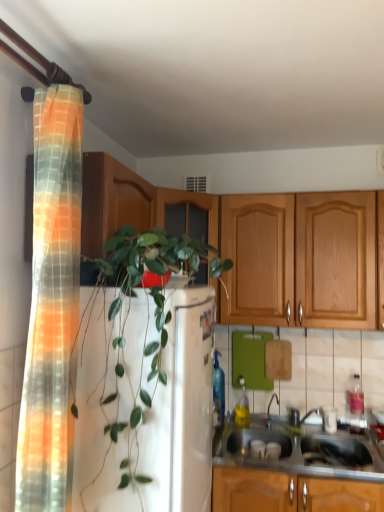
Question: Considering the relative sizes of green leafy plant at center and metallic silver faucet at sink right in the image provided, is green leafy plant at center thinner than metallic silver faucet at sink right?

Choices:
 (A) yes
 (B) no

Answer: (B)

Question: Does green leafy plant at center lie behind metallic silver faucet at sink right?

Choices:
 (A) no
 (B) yes

Answer: (A)

Question: From a real-world perspective, does green leafy plant at center sit lower than metallic silver faucet at sink right?

Choices:
 (A) yes
 (B) no

Answer: (B)

Question: Is green leafy plant at center facing towards metallic silver faucet at sink right?

Choices:
 (A) no
 (B) yes

Answer: (A)

Question: Can you confirm if green leafy plant at center is positioned to the left of metallic silver faucet at sink right?

Choices:
 (A) no
 (B) yes

Answer: (B)

Question: Relative to stainless steel sink at lower right, is metallic silver faucet at sink right in front or behind?

Choices:
 (A) front
 (B) behind

Answer: (B)

Question: Is metallic silver faucet at sink right spatially inside stainless steel sink at lower right, or outside of it?

Choices:
 (A) outside
 (B) inside

Answer: (A)

Question: Is metallic silver faucet at sink right wider or thinner than stainless steel sink at lower right?

Choices:
 (A) thin
 (B) wide

Answer: (A)

Question: In the image, is metallic silver faucet at sink right on the left side or the right side of stainless steel sink at lower right?

Choices:
 (A) left
 (B) right

Answer: (A)

Question: Is translucent orange-yellow fabric at left taller or shorter than green leafy plant at center?

Choices:
 (A) short
 (B) tall

Answer: (B)

Question: Considering the positions of translucent orange-yellow fabric at left and green leafy plant at center in the image, is translucent orange-yellow fabric at left wider or thinner than green leafy plant at center?

Choices:
 (A) thin
 (B) wide

Answer: (A)

Question: Is translucent orange-yellow fabric at left bigger or smaller than green leafy plant at center?

Choices:
 (A) small
 (B) big

Answer: (A)

Question: Considering the positions of point (77, 130) and point (145, 352), is point (77, 130) closer or farther from the camera than point (145, 352)?

Choices:
 (A) closer
 (B) farther

Answer: (A)

Question: Is metallic silver faucet at sink right wider or thinner than green leafy plant at center?

Choices:
 (A) wide
 (B) thin

Answer: (B)

Question: Is metallic silver faucet at sink right inside or outside of green leafy plant at center?

Choices:
 (A) outside
 (B) inside

Answer: (A)